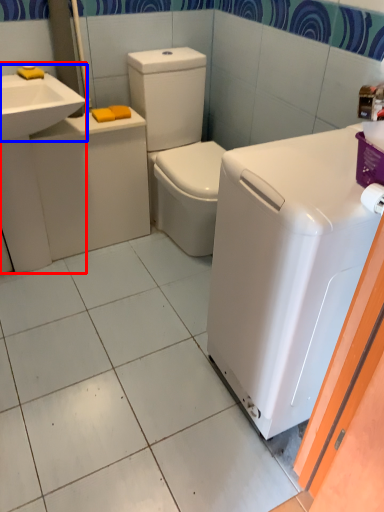
Question: Which point is closer to the camera, sink (highlighted by a red box) or sink (highlighted by a blue box)?

Choices:
 (A) sink
 (B) sink

Answer: (B)